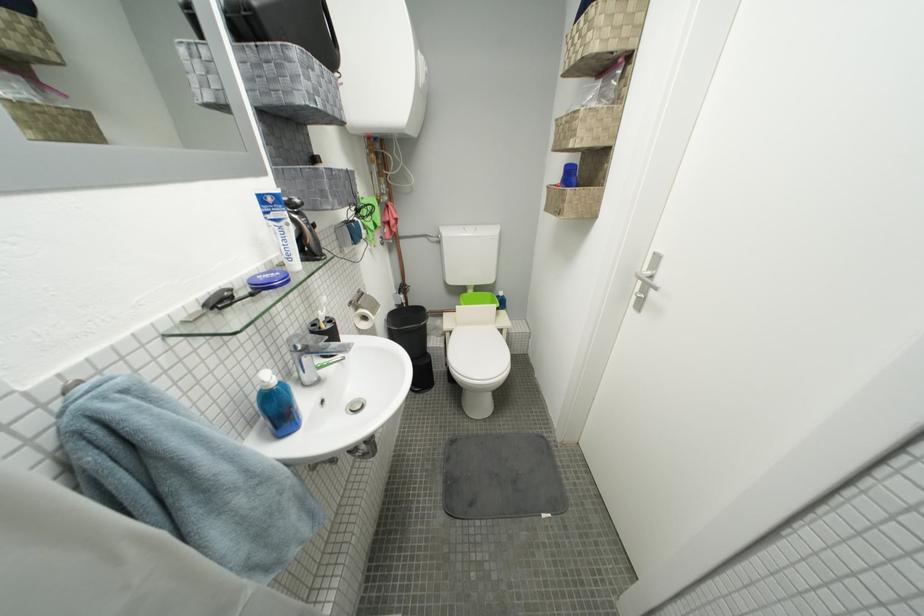
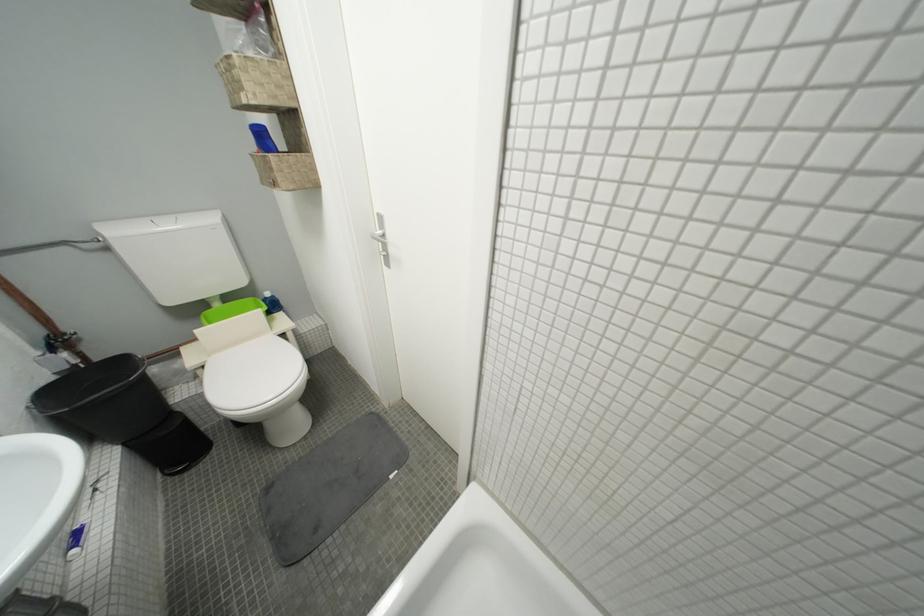
Question: How did the camera likely rotate?

Choices:
 (A) Left
 (B) Right
 (C) Up
 (D) Down

Answer: (B)